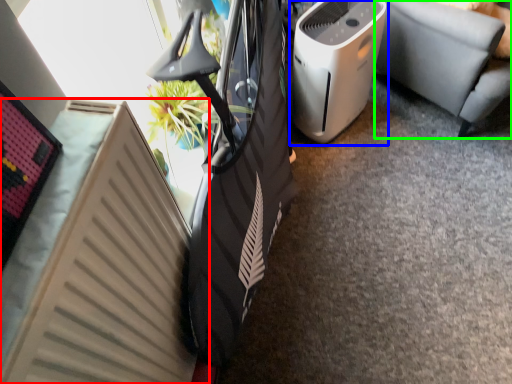
Question: Which object is positioned farthest from radiator (highlighted by a red box)? Select from home appliance (highlighted by a blue box) and furniture (highlighted by a green box).

Choices:
 (A) home appliance
 (B) furniture

Answer: (B)